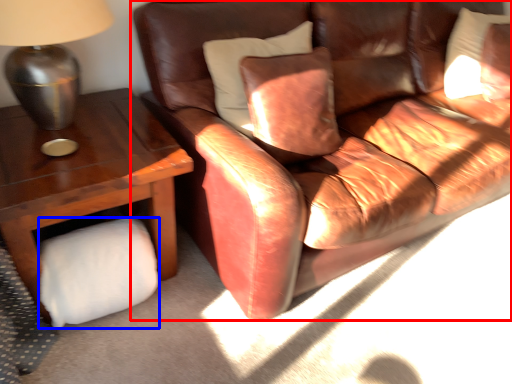
Question: Which point is closer to the camera, studio couch (highlighted by a red box) or toilet paper (highlighted by a blue box)?

Choices:
 (A) studio couch
 (B) toilet paper

Answer: (A)